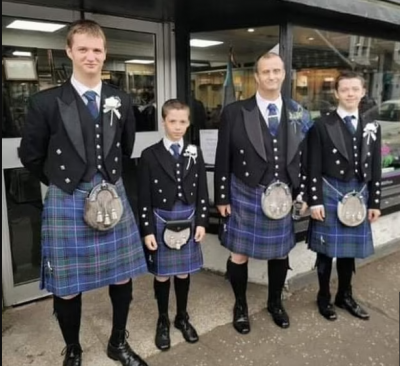
The image size is (400, 366). Find the location of `entrance`. entrance is located at coordinates (85, 22), (111, 66).